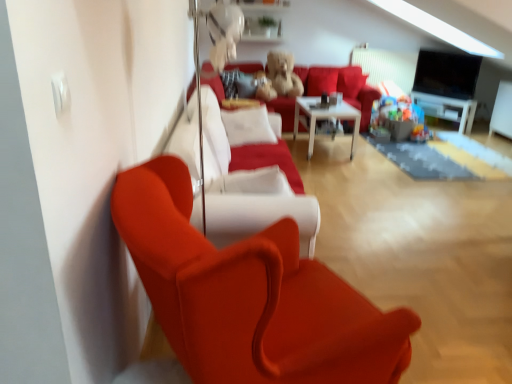
Question: Considering the relative sizes of velvet red couch at center and satin red couch at center in the image provided, is velvet red couch at center thinner than satin red couch at center?

Choices:
 (A) yes
 (B) no

Answer: (B)

Question: Does velvet red couch at center have a greater width compared to satin red couch at center?

Choices:
 (A) yes
 (B) no

Answer: (A)

Question: Is there a large distance between velvet red couch at center and satin red couch at center?

Choices:
 (A) no
 (B) yes

Answer: (B)

Question: From a real-world perspective, is velvet red couch at center physically above satin red couch at center?

Choices:
 (A) no
 (B) yes

Answer: (A)

Question: Is satin red couch at center at the back of velvet red couch at center?

Choices:
 (A) yes
 (B) no

Answer: (B)

Question: Is velvet red couch at center bigger or smaller than satin red couch at center?

Choices:
 (A) small
 (B) big

Answer: (A)

Question: Is velvet red couch at center inside or outside of satin red couch at center?

Choices:
 (A) outside
 (B) inside

Answer: (A)

Question: From a real-world perspective, is velvet red couch at center physically located above or below satin red couch at center?

Choices:
 (A) below
 (B) above

Answer: (A)

Question: Is velvet red couch at center in front of or behind satin red couch at center in the image?

Choices:
 (A) behind
 (B) front

Answer: (A)

Question: From the image's perspective, relative to satin red armchair at left, is white glossy entertainment center at right above or below?

Choices:
 (A) below
 (B) above

Answer: (B)

Question: From their relative heights in the image, would you say white glossy entertainment center at right is taller or shorter than satin red armchair at left?

Choices:
 (A) short
 (B) tall

Answer: (A)

Question: Is white glossy entertainment center at right in front of or behind satin red armchair at left in the image?

Choices:
 (A) behind
 (B) front

Answer: (A)

Question: Is white glossy entertainment center at right situated inside satin red armchair at left or outside?

Choices:
 (A) inside
 (B) outside

Answer: (B)

Question: Relative to white glossy table at center, is satin red armchair at left in front or behind?

Choices:
 (A) front
 (B) behind

Answer: (A)

Question: Based on their positions, is satin red armchair at left located to the left or right of white glossy table at center?

Choices:
 (A) right
 (B) left

Answer: (B)